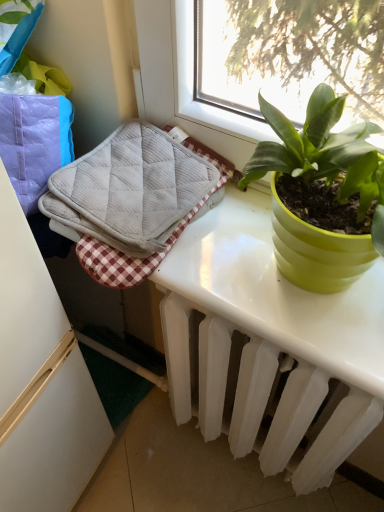
What are the coordinates of `green matte pot at upper right` in the screenshot? It's located at (322, 194).

The height and width of the screenshot is (512, 384). What do you see at coordinates (322, 194) in the screenshot? I see `green matte pot at upper right` at bounding box center [322, 194].

At what (x,y) coordinates should I click in order to perform the action: click on green matte pot at upper right. Please return your answer as a coordinate pair (x, y). This screenshot has height=512, width=384. Looking at the image, I should click on (322, 194).